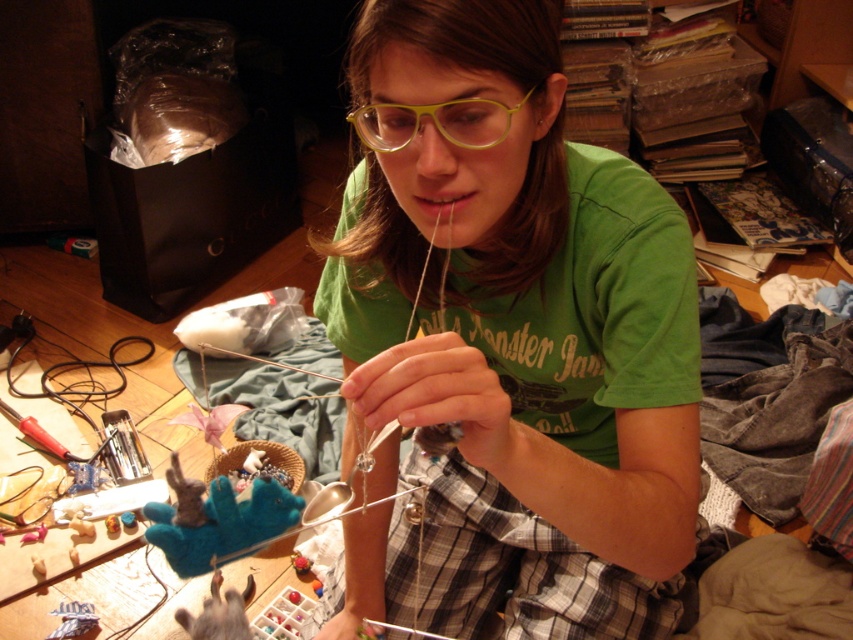
Question: Does matte silver necklace at center have a lesser width compared to plaid fabric hand at lower center?

Choices:
 (A) no
 (B) yes

Answer: (A)

Question: Which point is closer to the camera?

Choices:
 (A) (424, 404)
 (B) (321, 636)
 (C) (502, 433)

Answer: (A)

Question: Among these objects, which one is nearest to the camera?

Choices:
 (A) green matte shirt at center
 (B) plaid fabric hand at lower center
 (C) matte silver necklace at center

Answer: (C)

Question: Can you confirm if matte silver necklace at center is positioned below yellow plastic glasses at center?

Choices:
 (A) yes
 (B) no

Answer: (A)

Question: Is green matte shirt at center bigger than yellow plastic glasses at center?

Choices:
 (A) no
 (B) yes

Answer: (B)

Question: Which point appears closest to the camera in this image?

Choices:
 (A) (480, 454)
 (B) (402, 484)
 (C) (415, 122)

Answer: (A)